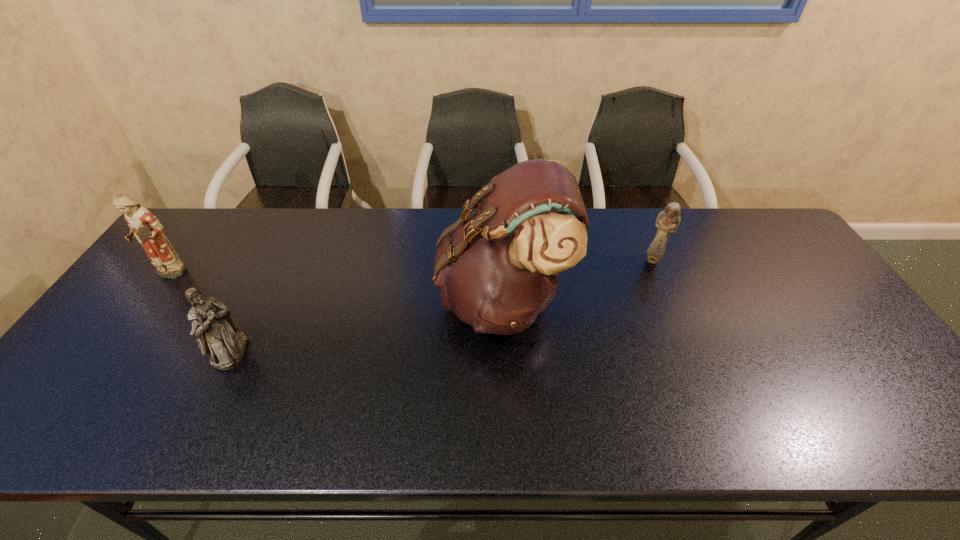
Identify the location of the third object from left to right. (497, 269).

Where is `satchel`? satchel is located at coordinates (497, 269).

Image resolution: width=960 pixels, height=540 pixels. I want to click on the tallest figurine, so click(x=145, y=227).

Find the location of a particular element. This screenshot has width=960, height=540. the second tallest object is located at coordinates (145, 227).

Locate an element on the screen. The width and height of the screenshot is (960, 540). the third object from right to left is located at coordinates (216, 332).

Locate an element on the screen. This screenshot has width=960, height=540. the nearest figurine is located at coordinates (216, 332).

Locate an element on the screen. This screenshot has width=960, height=540. the rightmost figurine is located at coordinates (668, 220).

Identify the location of vacant space located 0.120m at the front of the satchel with buckles. tap(394, 300).

Identify the location of free space located 0.160m at the front of the satchel with buckles. This screenshot has height=540, width=960. (380, 300).

The image size is (960, 540). Identify the location of free space located 0.380m at the front of the satchel with buckles. (300, 300).